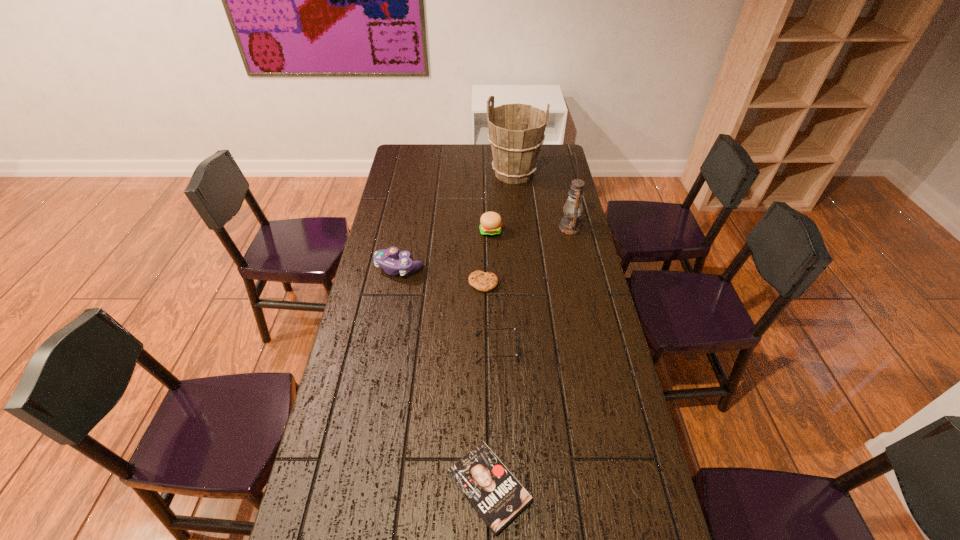
Locate an element on the screen. free space between the bucket and the control is located at coordinates (457, 220).

Find the location of a particular element. This screenshot has height=540, width=960. vacant space that is in between the hamburger and the rightmost object is located at coordinates (531, 230).

Identify the location of free space between the cookie and the fifth tallest object. The width and height of the screenshot is (960, 540). (490, 316).

Identify the location of unoccupied area between the book and the control. point(444,377).

This screenshot has width=960, height=540. I want to click on free space between the book and the oil lamp, so click(x=529, y=357).

Choose which object is the fifth nearest neighbor to the book. Please provide its 2D coordinates. Your answer should be formatted as a tuple, i.e. [(x, y)], where the tuple contains the x and y coordinates of a point satisfying the conditions above.

[(570, 224)]

The height and width of the screenshot is (540, 960). Find the location of `the sixth closest object to the cookie`. the sixth closest object to the cookie is located at coordinates (496, 495).

Locate an element on the screen. This screenshot has height=540, width=960. vacant space that satisfies the following two spatial constraints: 1. on the back side of the oil lamp; 2. on the right side of the nearest object is located at coordinates (485, 227).